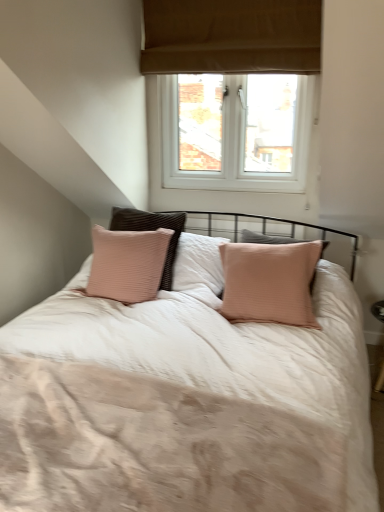
Question: Is light beige fabric bed at center taller or shorter than white plastic window at upper center?

Choices:
 (A) tall
 (B) short

Answer: (B)

Question: Do you think light beige fabric bed at center is within white plastic window at upper center, or outside of it?

Choices:
 (A) inside
 (B) outside

Answer: (B)

Question: Does point (364, 473) appear closer or farther from the camera than point (160, 57)?

Choices:
 (A) closer
 (B) farther

Answer: (A)

Question: From a real-world perspective, is white plastic window at upper center above or below light beige fabric bed at center?

Choices:
 (A) below
 (B) above

Answer: (B)

Question: Based on their sizes in the image, would you say white plastic window at upper center is bigger or smaller than light beige fabric bed at center?

Choices:
 (A) big
 (B) small

Answer: (A)

Question: Considering the positions of white plastic window at upper center and light beige fabric bed at center in the image, is white plastic window at upper center taller or shorter than light beige fabric bed at center?

Choices:
 (A) short
 (B) tall

Answer: (B)

Question: Is white plastic window at upper center in front of or behind light beige fabric bed at center in the image?

Choices:
 (A) front
 (B) behind

Answer: (B)